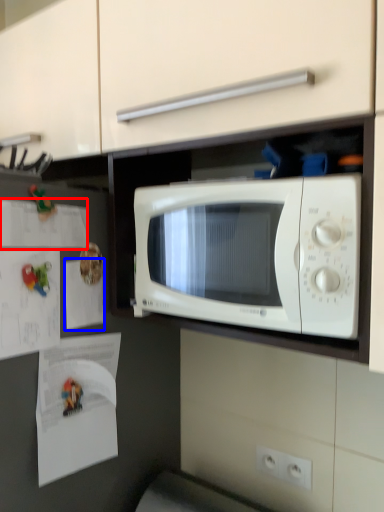
Question: Which of the following is the closest to the observer, paper (highlighted by a red box) or paper (highlighted by a blue box)?

Choices:
 (A) paper
 (B) paper

Answer: (A)